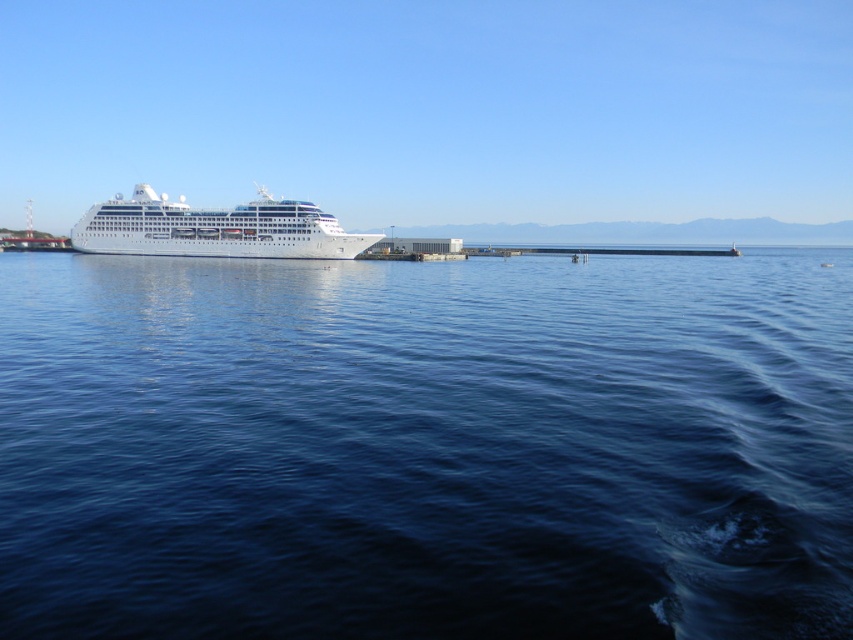
Between blue liquid water at center and white glossy cruise ship at center, which one has more height?

white glossy cruise ship at center

Locate an element on the screen. The image size is (853, 640). blue liquid water at center is located at coordinates (426, 448).

The image size is (853, 640). I want to click on blue liquid water at center, so click(426, 448).